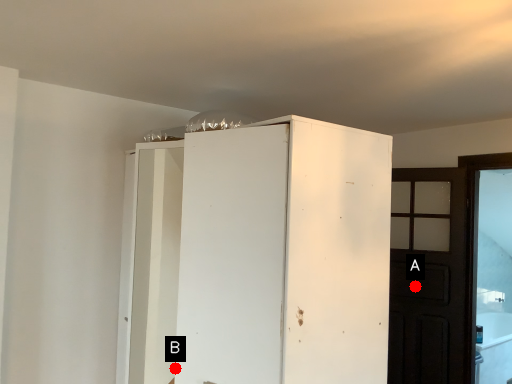
Question: Two points are circled on the image, labeled by A and B beside each circle. Which point is farther to the camera?

Choices:
 (A) A is further
 (B) B is further

Answer: (B)